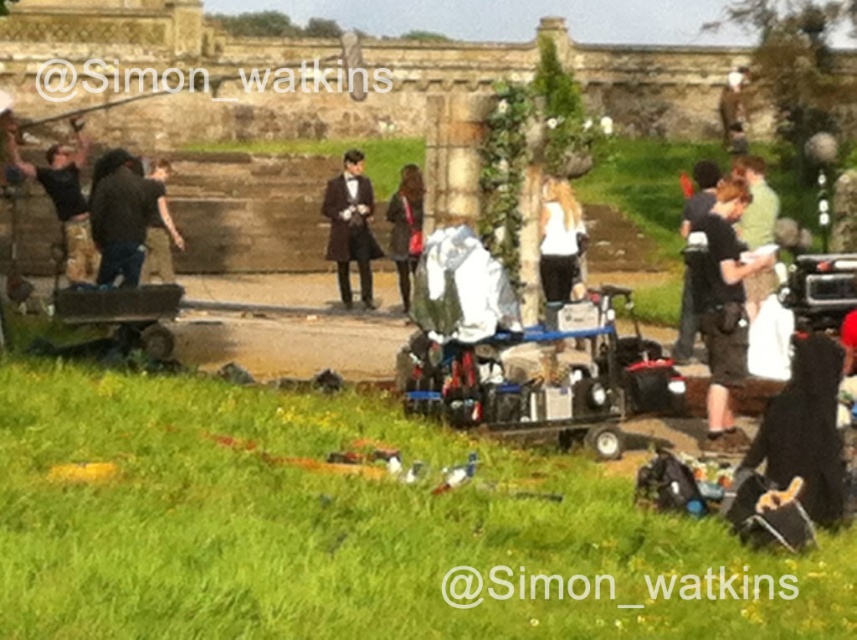
Question: Which object appears closest to the camera in this image?

Choices:
 (A) camouflage pants at left
 (B) dark gray fabric jacket at center
 (C) matte brown coat at center

Answer: (B)

Question: In this image, where is black cotton shirt at right located relative to dark gray fabric jacket at center?

Choices:
 (A) above
 (B) below

Answer: (B)

Question: Does green grass at lower center appear under black cotton shirt at right?

Choices:
 (A) yes
 (B) no

Answer: (A)

Question: Where is camouflage pants at left located in relation to matte brown coat at center in the image?

Choices:
 (A) above
 (B) below

Answer: (A)

Question: Which object is the closest to the camouflage pants at left?

Choices:
 (A) green grass at lower center
 (B) dark gray fabric jacket at center
 (C) matte brown coat at center

Answer: (B)

Question: Which object appears farthest from the camera in this image?

Choices:
 (A) matte brown coat at center
 (B) shiny brown coat at center
 (C) camouflage pants at left
 (D) dark gray fabric jacket at center

Answer: (A)